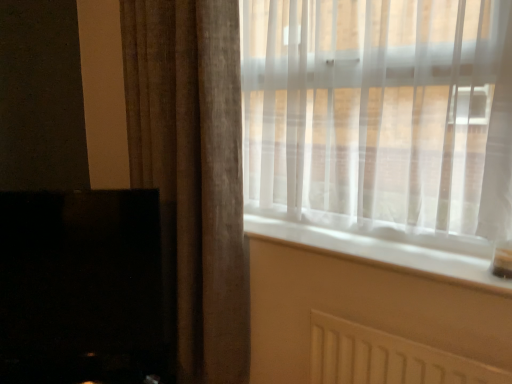
Question: From the image's perspective, is brown textured curtain at left above or below translucent fabric window at upper right?

Choices:
 (A) above
 (B) below

Answer: (B)

Question: Is brown textured curtain at left in front of or behind translucent fabric window at upper right in the image?

Choices:
 (A) front
 (B) behind

Answer: (B)

Question: Which object is positioned farthest from the translucent fabric window at upper right?

Choices:
 (A) brown textured curtain at left
 (B) white smooth window sill at center
 (C) black glossy fireplace at lower left

Answer: (C)

Question: Which of these objects is positioned farthest from the brown textured curtain at left?

Choices:
 (A) translucent fabric window at upper right
 (B) black glossy fireplace at lower left
 (C) white smooth window sill at center

Answer: (C)